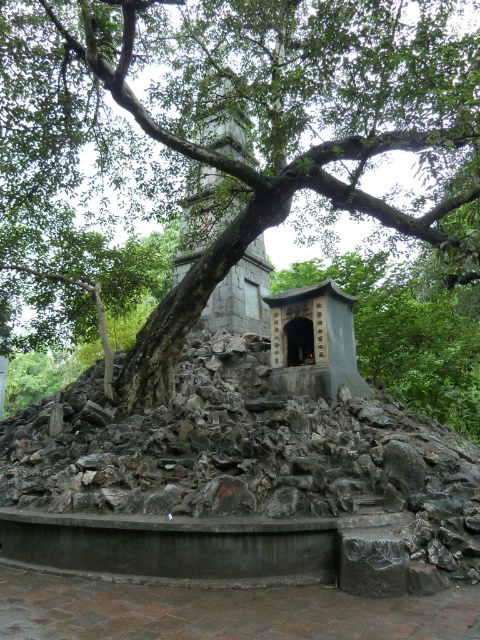
Question: Which point is closer to the camera?

Choices:
 (A) (211, 173)
 (B) (242, 20)

Answer: (B)

Question: Among these points, which one is nearest to the camera?

Choices:
 (A) tap(228, 275)
 (B) tap(296, 156)

Answer: (B)

Question: From the image, what is the correct spatial relationship of green leafy tree at center in relation to gray stone tower at center?

Choices:
 (A) left
 (B) right

Answer: (A)

Question: Which point appears closest to the camera in this image?

Choices:
 (A) (191, 228)
 (B) (144, 387)

Answer: (B)

Question: Is green leafy tree at center positioned behind gray stone tower at center?

Choices:
 (A) no
 (B) yes

Answer: (A)

Question: Does green leafy tree at center have a larger size compared to gray stone tower at center?

Choices:
 (A) yes
 (B) no

Answer: (A)